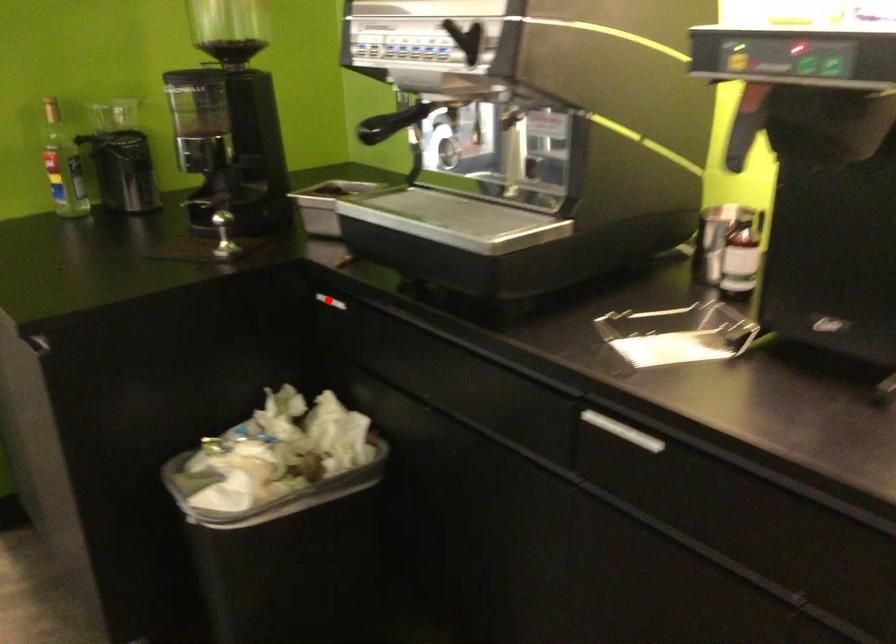
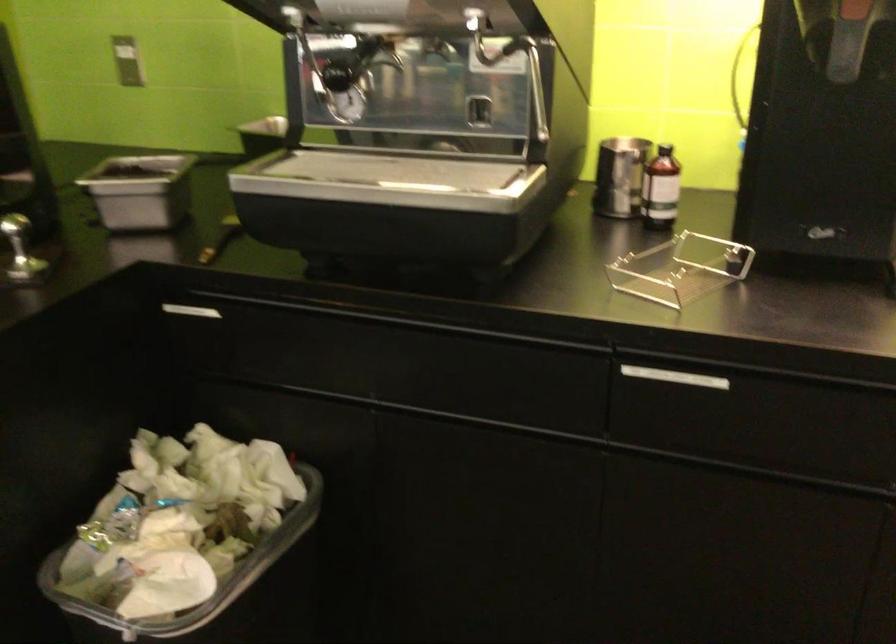
Where in the second image is the point corresponding to the highlighted location from the first image?

(192, 310)